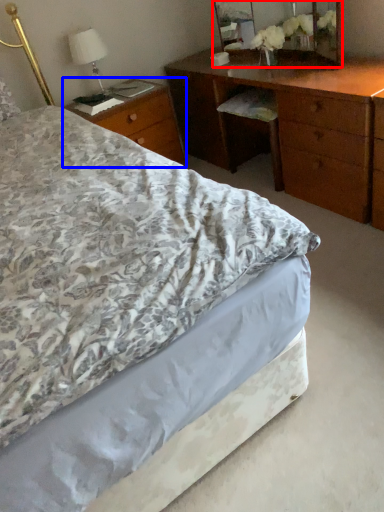
Question: Which point is closer to the camera, mirror (highlighted by a red box) or nightstand (highlighted by a blue box)?

Choices:
 (A) mirror
 (B) nightstand

Answer: (A)